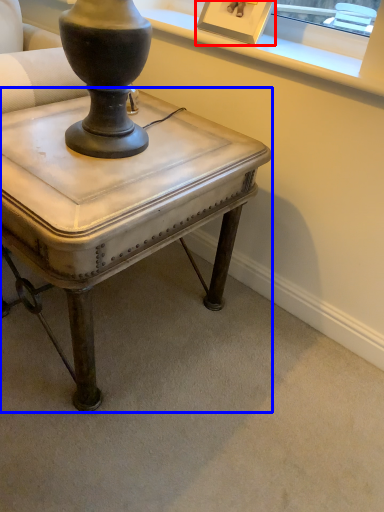
Question: Which point is closer to the camera, picture frame (highlighted by a red box) or table (highlighted by a blue box)?

Choices:
 (A) picture frame
 (B) table

Answer: (B)